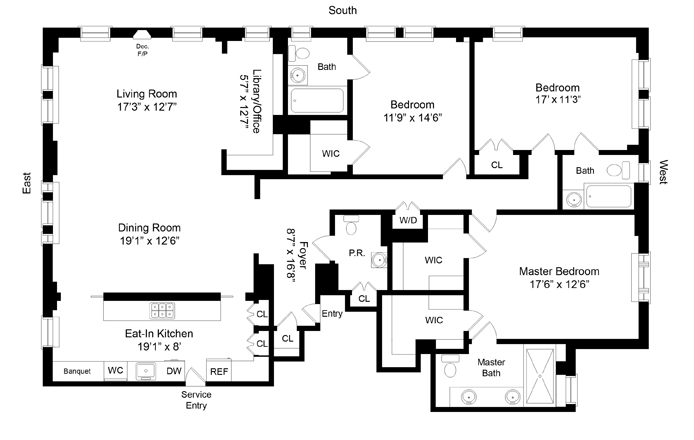
This screenshot has height=440, width=694. Identify the location of bedroom. (564, 77).